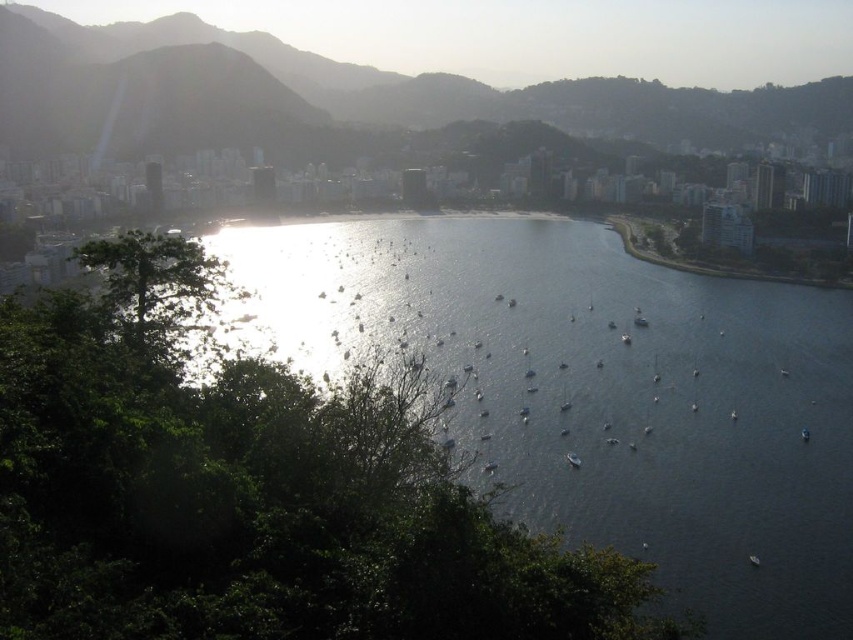
Question: Is green textured mountain at upper center to the left of green leafy tree at left from the viewer's perspective?

Choices:
 (A) yes
 (B) no

Answer: (B)

Question: Does green leafy tree at center-left appear over green leafy tree at left?

Choices:
 (A) yes
 (B) no

Answer: (B)

Question: Estimate the real-world distances between objects in this image. Which object is closer to the green leafy tree at center-left?

Choices:
 (A) green leafy tree at left
 (B) green textured mountain at upper center

Answer: (A)

Question: Does green leafy tree at center-left appear on the right side of green textured mountain at upper center?

Choices:
 (A) no
 (B) yes

Answer: (A)

Question: Which object is closer to the camera taking this photo?

Choices:
 (A) green leafy tree at center-left
 (B) green textured mountain at upper center
 (C) green leafy tree at left

Answer: (A)

Question: Estimate the real-world distances between objects in this image. Which object is closer to the green leafy tree at left?

Choices:
 (A) green textured mountain at upper center
 (B) green leafy tree at center-left

Answer: (B)